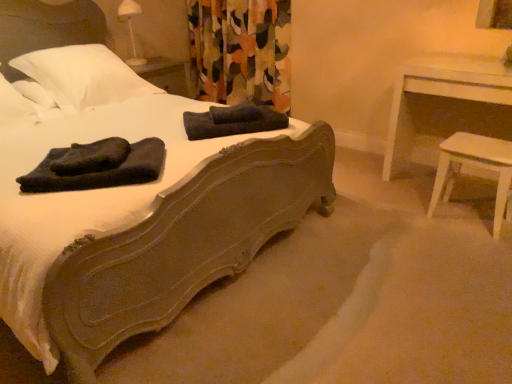
Question: Are dark blue fleece bath towel at center, which is the 1th bath towel from front to back, and white soft pillow at upper left, the first pillow positioned from the right, located far from each other?

Choices:
 (A) no
 (B) yes

Answer: (B)

Question: Is the position of dark blue fleece bath towel at center, the 3th bath towel viewed from the back, more distant than that of white soft pillow at upper left, which ranks as the second pillow in left-to-right order?

Choices:
 (A) no
 (B) yes

Answer: (A)

Question: Can you confirm if dark blue fleece bath towel at center, the 3th bath towel viewed from the back, is smaller than white soft pillow at upper left, the first pillow positioned from the right?

Choices:
 (A) yes
 (B) no

Answer: (A)

Question: Is the depth of dark blue fleece bath towel at center, which is the 1th bath towel from front to back, less than that of white soft pillow at upper left, the first pillow positioned from the right?

Choices:
 (A) no
 (B) yes

Answer: (B)

Question: Is dark blue fleece bath towel at center, the 3th bath towel viewed from the back, facing away from white soft pillow at upper left, which ranks as the second pillow in left-to-right order?

Choices:
 (A) yes
 (B) no

Answer: (A)

Question: Which is correct: dark blue fleece bath towel at center, the 3th bath towel viewed from the back, is inside dark gray cotton bath towel at center, positioned as the third bath towel in front-to-back order, or outside of it?

Choices:
 (A) outside
 (B) inside

Answer: (A)

Question: Looking at the image, does dark blue fleece bath towel at center, which is the 1th bath towel from front to back, seem bigger or smaller compared to dark gray cotton bath towel at center, the 1th bath towel from the back?

Choices:
 (A) big
 (B) small

Answer: (B)

Question: Is point (158, 147) positioned closer to the camera than point (234, 115)?

Choices:
 (A) closer
 (B) farther

Answer: (A)

Question: Visually, is dark blue fleece bath towel at center, which is the 1th bath towel from front to back, positioned to the left or to the right of dark gray cotton bath towel at center, the 1th bath towel from the back?

Choices:
 (A) right
 (B) left

Answer: (B)

Question: From a real-world perspective, is white soft pillow at upper left, arranged as the second pillow when viewed from the right, above or below dark gray cotton bath towel at center, the 1th bath towel from the back?

Choices:
 (A) above
 (B) below

Answer: (A)

Question: Would you say white soft pillow at upper left, marked as the 1th pillow in a left-to-right arrangement, is to the left or to the right of dark gray cotton bath towel at center, the 1th bath towel from the back, in the picture?

Choices:
 (A) right
 (B) left

Answer: (B)

Question: Is white soft pillow at upper left, arranged as the second pillow when viewed from the right, bigger or smaller than dark gray cotton bath towel at center, the 1th bath towel from the back?

Choices:
 (A) small
 (B) big

Answer: (B)

Question: From the image's perspective, is white soft pillow at upper left, marked as the 1th pillow in a left-to-right arrangement, located above or below dark gray cotton bath towel at center, positioned as the third bath towel in front-to-back order?

Choices:
 (A) below
 (B) above

Answer: (B)

Question: From a real-world perspective, is white wood table at right positioned above or below dark gray cotton bath towel at center, positioned as the third bath towel in front-to-back order?

Choices:
 (A) below
 (B) above

Answer: (A)

Question: Considering the relative positions of white wood table at right and dark gray cotton bath towel at center, positioned as the third bath towel in front-to-back order, in the image provided, is white wood table at right to the left or to the right of dark gray cotton bath towel at center, positioned as the third bath towel in front-to-back order,?

Choices:
 (A) left
 (B) right

Answer: (B)